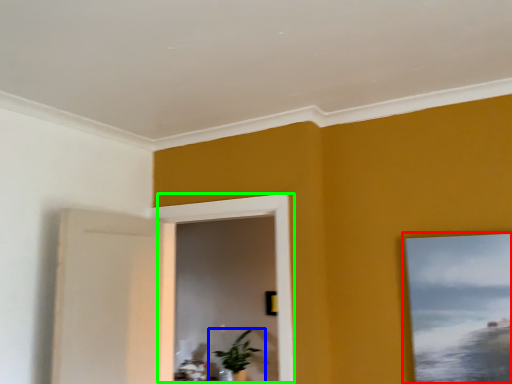
Question: Which object is positioned closest to picture frame (highlighted by a red box)? Select from houseplant (highlighted by a blue box) and window (highlighted by a green box).

Choices:
 (A) houseplant
 (B) window

Answer: (B)